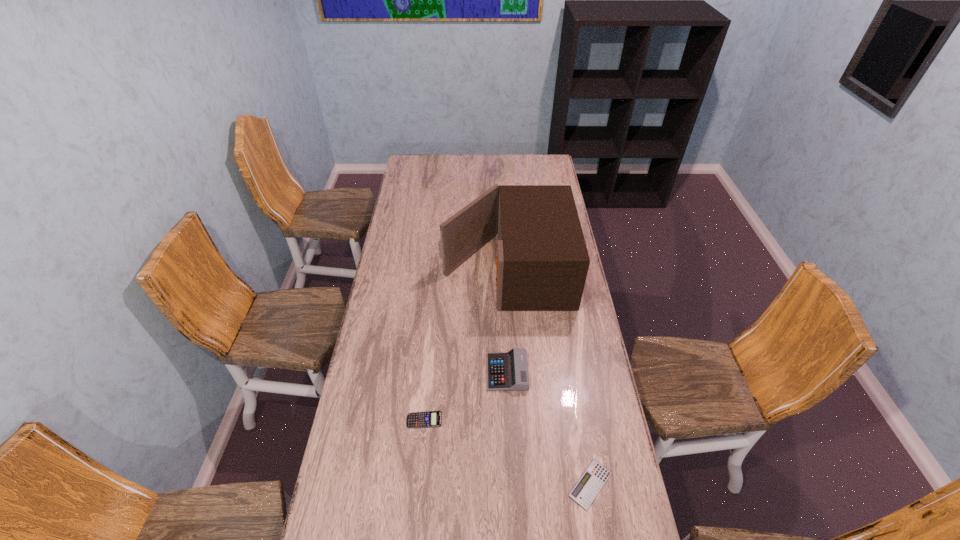
Where is `free area in between the third tallest object and the microwave oven`? This screenshot has width=960, height=540. free area in between the third tallest object and the microwave oven is located at coordinates (465, 345).

What are the coordinates of `vacant point located between the shortest calculator and the farthest object` in the screenshot? It's located at (548, 377).

Where is `vacant region between the second shortest object and the tallest object`? The height and width of the screenshot is (540, 960). vacant region between the second shortest object and the tallest object is located at coordinates (465, 345).

Where is `free space between the third tallest object and the farthest object`? free space between the third tallest object and the farthest object is located at coordinates (465, 345).

At what (x,y) coordinates should I click in order to perform the action: click on object that is the third nearest to the second nearest calculator. Please return your answer as a coordinate pair (x, y). Looking at the image, I should click on (542, 262).

Locate an element on the screen. Image resolution: width=960 pixels, height=540 pixels. the second closest object to the shortest object is located at coordinates (428, 419).

Image resolution: width=960 pixels, height=540 pixels. I want to click on the second closest calculator to the third tallest object, so click(x=587, y=488).

Identify which calculator is the nearest to the second nearest calculator. Please provide its 2D coordinates. Your answer should be formatted as a tuple, i.e. [(x, y)], where the tuple contains the x and y coordinates of a point satisfying the conditions above.

[(508, 371)]